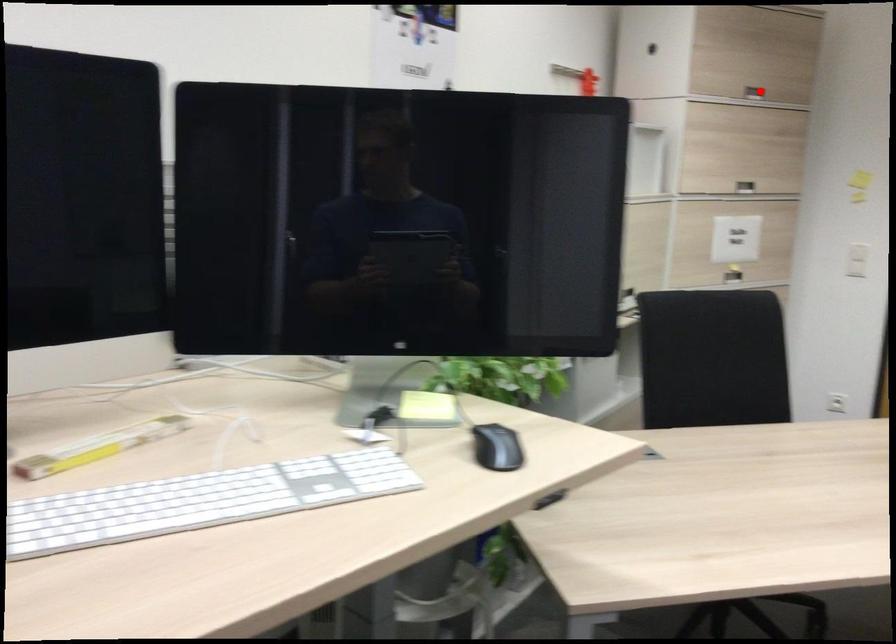
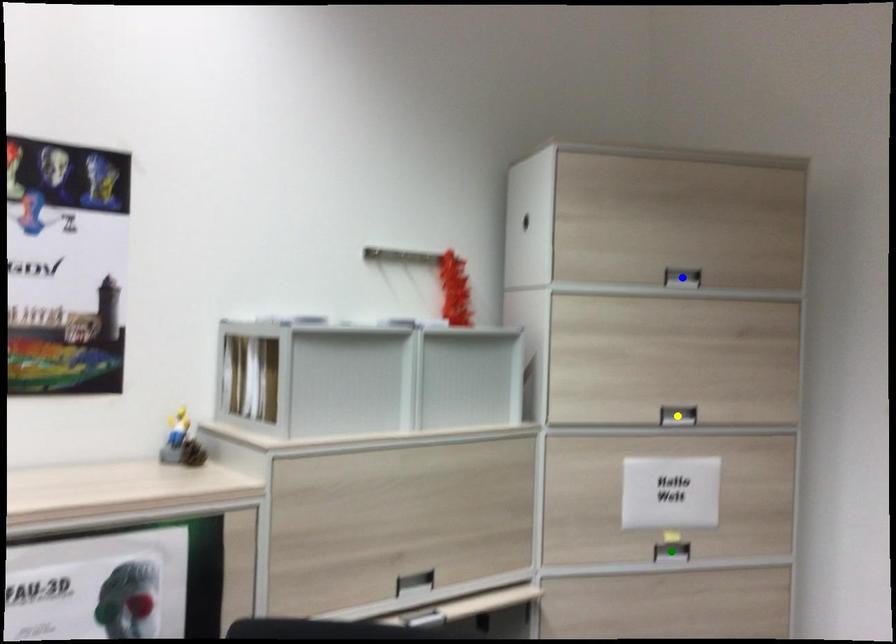
Question: I am providing you with two images of the same scene from different viewpoints. A red point is marked on the first image. You are given multiple points on the second image. Can you choose the point in image 2 that corresponds to the point in image 1?

Choices:
 (A) blue point
 (B) green point
 (C) yellow point

Answer: (A)